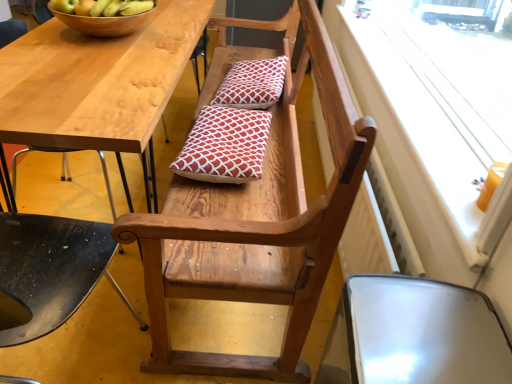
The width and height of the screenshot is (512, 384). I want to click on white matte window screen at upper right, so click(x=447, y=113).

Consider the image. What is the approximate width of wooden chair at lower center, which appears as the 3th chair when viewed from the right?

wooden chair at lower center, which appears as the 3th chair when viewed from the right, is 19.70 inches wide.

The image size is (512, 384). In order to click on red printed cushion at center, the 2th pillow positioned from the bottom in this screenshot , I will do `click(252, 84)`.

Describe the element at coordinates (104, 23) in the screenshot. I see `wooden bowl at upper left` at that location.

The height and width of the screenshot is (384, 512). What do you see at coordinates (424, 332) in the screenshot?
I see `metallic silver chair at lower right, the first chair in the right-to-left sequence` at bounding box center [424, 332].

Locate an element on the screen. This screenshot has height=384, width=512. wooden chair at center, the 2th chair positioned from the right is located at coordinates (256, 229).

This screenshot has width=512, height=384. Find the location of `white matte window screen at upper right`. white matte window screen at upper right is located at coordinates (447, 113).

Is green matte apple at upper left, positioned as the second apple in left-to-right order, facing away from red printed cushion at center, which ranks as the first pillow in bottom-to-top order?

green matte apple at upper left, positioned as the second apple in left-to-right order, does not have its back to red printed cushion at center, which ranks as the first pillow in bottom-to-top order.

From the image's perspective, which is above, green matte apple at upper left, which ranks as the 1th apple in right-to-left order, or red printed cushion at center, which ranks as the first pillow in bottom-to-top order?

green matte apple at upper left, which ranks as the 1th apple in right-to-left order, is shown above in the image.

Can you confirm if green matte apple at upper left, which ranks as the 1th apple in right-to-left order, is bigger than red printed cushion at center, the first pillow from the front?

No, green matte apple at upper left, which ranks as the 1th apple in right-to-left order, is not bigger than red printed cushion at center, the first pillow from the front.

Which of these two, green matte apple at upper left, which ranks as the 1th apple in right-to-left order, or red printed cushion at center, marked as the 2th pillow in a back-to-front arrangement, is wider?

Wider between the two is red printed cushion at center, marked as the 2th pillow in a back-to-front arrangement.

Considering the sizes of objects white matte window screen at upper right and metallic silver chair at lower right, the first chair in the right-to-left sequence, in the image provided, who is smaller, white matte window screen at upper right or metallic silver chair at lower right, the first chair in the right-to-left sequence,?

With smaller size is white matte window screen at upper right.

From the image's perspective, is white matte window screen at upper right located above or below metallic silver chair at lower right, which is counted as the 3th chair, starting from the left?

From the image's perspective, white matte window screen at upper right appears above metallic silver chair at lower right, which is counted as the 3th chair, starting from the left.

Which point is more distant from viewer, (456, 165) or (410, 375)?

The point (456, 165) is farther.

Would you consider white matte window screen at upper right to be distant from metallic silver chair at lower right, the first chair in the right-to-left sequence?

No, there isn't a large distance between white matte window screen at upper right and metallic silver chair at lower right, the first chair in the right-to-left sequence.

At what (x,y) coordinates should I click in order to perform the action: click on bowl that appears above the red printed cushion at center, the 1th pillow viewed from the top (from a real-world perspective). Please return your answer as a coordinate pair (x, y). Looking at the image, I should click on (104, 23).

Can you confirm if red printed cushion at center, the 2th pillow positioned from the bottom, is thinner than wooden bowl at upper left?

Indeed, red printed cushion at center, the 2th pillow positioned from the bottom, has a lesser width compared to wooden bowl at upper left.

From the image's perspective, would you say red printed cushion at center, the 1th pillow viewed from the top, is positioned over wooden bowl at upper left?

No, from the image's perspective, red printed cushion at center, the 1th pillow viewed from the top, is not over wooden bowl at upper left.

Would you consider red printed cushion at center, the 1th pillow viewed from the top, to be distant from wooden bowl at upper left?

No, red printed cushion at center, the 1th pillow viewed from the top, is in close proximity to wooden bowl at upper left.

Based on the photo, could you tell me if green matte apple at upper left, which ranks as the second apple in right-to-left order, is turned towards red printed cushion at center, the 1th pillow viewed from the top?

No.

In terms of width, does green matte apple at upper left, which ranks as the second apple in right-to-left order, look wider or thinner when compared to red printed cushion at center, the 2th pillow when ordered from front to back?

In the image, green matte apple at upper left, which ranks as the second apple in right-to-left order, appears to be more narrow than red printed cushion at center, the 2th pillow when ordered from front to back.

From the image's perspective, is green matte apple at upper left, which ranks as the second apple in right-to-left order, over red printed cushion at center, the 2th pillow positioned from the bottom?

Correct, green matte apple at upper left, which ranks as the second apple in right-to-left order, appears higher than red printed cushion at center, the 2th pillow positioned from the bottom, in the image.

Considering the relative positions of wooden chair at lower center, which appears as the 3th chair when viewed from the right, and green matte apple at upper left, positioned as the second apple in left-to-right order, in the image provided, is wooden chair at lower center, which appears as the 3th chair when viewed from the right, to the left of green matte apple at upper left, positioned as the second apple in left-to-right order, from the viewer's perspective?

Indeed, wooden chair at lower center, which appears as the 3th chair when viewed from the right, is positioned on the left side of green matte apple at upper left, positioned as the second apple in left-to-right order.

Does wooden chair at lower center, the first chair from the left, contain green matte apple at upper left, which ranks as the 1th apple in right-to-left order?

No, wooden chair at lower center, the first chair from the left, does not contain green matte apple at upper left, which ranks as the 1th apple in right-to-left order.

From the picture: What's the angular difference between wooden chair at lower center, the first chair from the left, and green matte apple at upper left, positioned as the second apple in left-to-right order,'s facing directions?

There is a 3.6-degree angle between the facing directions of wooden chair at lower center, the first chair from the left, and green matte apple at upper left, positioned as the second apple in left-to-right order.

Is wooden chair at lower center, the first chair from the left, facing away from green matte apple at upper left, positioned as the second apple in left-to-right order?

No, wooden chair at lower center, the first chair from the left, is not facing the opposite direction of green matte apple at upper left, positioned as the second apple in left-to-right order.

Is wooden chair at center, which is counted as the second chair, starting from the left, situated inside green matte apple at upper left, positioned as the second apple in left-to-right order, or outside?

The correct answer is: outside.

Can you confirm if wooden chair at center, which is counted as the second chair, starting from the left, is positioned to the right of green matte apple at upper left, positioned as the second apple in left-to-right order?

Indeed, wooden chair at center, which is counted as the second chair, starting from the left, is positioned on the right side of green matte apple at upper left, positioned as the second apple in left-to-right order.

Consider the image. Which object is further away from the camera taking this photo, wooden chair at center, the 2th chair positioned from the right, or green matte apple at upper left, positioned as the second apple in left-to-right order?

green matte apple at upper left, positioned as the second apple in left-to-right order, is behind.

Looking at this image, from the image's perspective, would you say wooden chair at center, which is counted as the second chair, starting from the left, is shown under green matte apple at upper left, which ranks as the 1th apple in right-to-left order?

Yes, from the image's perspective, wooden chair at center, which is counted as the second chair, starting from the left, is below green matte apple at upper left, which ranks as the 1th apple in right-to-left order.

Looking at this image, is metallic silver chair at lower right, the first chair in the right-to-left sequence, taller or shorter than green matte apple at upper left, the 1th apple in the left-to-right sequence?

metallic silver chair at lower right, the first chair in the right-to-left sequence, is taller than green matte apple at upper left, the 1th apple in the left-to-right sequence.

From the image's perspective, would you say metallic silver chair at lower right, which is counted as the 3th chair, starting from the left, is positioned over green matte apple at upper left, the 1th apple in the left-to-right sequence?

No, from the image's perspective, metallic silver chair at lower right, which is counted as the 3th chair, starting from the left, is not above green matte apple at upper left, the 1th apple in the left-to-right sequence.

Considering the sizes of objects metallic silver chair at lower right, which is counted as the 3th chair, starting from the left, and green matte apple at upper left, which ranks as the second apple in right-to-left order, in the image provided, who is bigger, metallic silver chair at lower right, which is counted as the 3th chair, starting from the left, or green matte apple at upper left, which ranks as the second apple in right-to-left order,?

metallic silver chair at lower right, which is counted as the 3th chair, starting from the left.

How many degrees apart are the facing directions of metallic silver chair at lower right, the first chair in the right-to-left sequence, and green matte apple at upper left, which ranks as the second apple in right-to-left order?

The angular difference between metallic silver chair at lower right, the first chair in the right-to-left sequence, and green matte apple at upper left, which ranks as the second apple in right-to-left order, is 90 degrees.

Locate an element on the screen. pillow that is the 2nd object directly below the green matte apple at upper left, positioned as the second apple in left-to-right order (from a real-world perspective) is located at coordinates (225, 146).

Find the location of a particular element. The width and height of the screenshot is (512, 384). chair that is the 2nd one when counting forward from the white matte window screen at upper right is located at coordinates (424, 332).

Looking at the image, which one is located closer to wooden chair at lower center, the first chair from the left, red printed cushion at center, the 2th pillow when ordered from front to back, or green matte apple at upper left, which ranks as the second apple in right-to-left order?

Based on the image, green matte apple at upper left, which ranks as the second apple in right-to-left order, appears to be nearer to wooden chair at lower center, the first chair from the left.

Estimate the real-world distances between objects in this image. Which object is further from green matte apple at upper left, the 1th apple in the left-to-right sequence, wooden chair at center, the 2th chair positioned from the right, or white matte window screen at upper right?

The object further to green matte apple at upper left, the 1th apple in the left-to-right sequence, is white matte window screen at upper right.

Considering their positions, is red printed cushion at center, which ranks as the first pillow in bottom-to-top order, positioned closer to wooden chair at lower center, which appears as the 3th chair when viewed from the right, than wooden chair at center, the 2th chair positioned from the right?

wooden chair at center, the 2th chair positioned from the right, is closer to wooden chair at lower center, which appears as the 3th chair when viewed from the right.

Considering their positions, is wooden chair at center, the 2th chair positioned from the right, positioned further to red printed cushion at center, the 2th pillow positioned from the bottom, than metallic silver chair at lower right, the first chair in the right-to-left sequence?

metallic silver chair at lower right, the first chair in the right-to-left sequence.

Consider the image. Based on their spatial positions, is green matte apple at upper left, which ranks as the second apple in right-to-left order, or wooden chair at center, the 2th chair positioned from the right, further from green matte apple at upper left, which ranks as the 1th apple in right-to-left order?

wooden chair at center, the 2th chair positioned from the right, is positioned further to the anchor green matte apple at upper left, which ranks as the 1th apple in right-to-left order.

From the image, which object appears to be nearer to wooden bowl at upper left, red printed cushion at center, which is the first pillow from back to front, or white matte window screen at upper right?

The object closer to wooden bowl at upper left is red printed cushion at center, which is the first pillow from back to front.

When comparing their distances from green matte apple at upper left, positioned as the second apple in left-to-right order, does wooden bowl at upper left or wooden chair at center, the 2th chair positioned from the right, seem further?

wooden chair at center, the 2th chair positioned from the right, lies further to green matte apple at upper left, positioned as the second apple in left-to-right order, than the other object.

Based on their spatial positions, is wooden chair at lower center, which appears as the 3th chair when viewed from the right, or green matte apple at upper left, positioned as the second apple in left-to-right order, further from wooden chair at center, which is counted as the second chair, starting from the left?

Among the two, green matte apple at upper left, positioned as the second apple in left-to-right order, is located further to wooden chair at center, which is counted as the second chair, starting from the left.

Where is `window screen between wooden chair at center, the 2th chair positioned from the right, and red printed cushion at center, the 1th pillow viewed from the top, from front to back`? Image resolution: width=512 pixels, height=384 pixels. window screen between wooden chair at center, the 2th chair positioned from the right, and red printed cushion at center, the 1th pillow viewed from the top, from front to back is located at coordinates (447, 113).

This screenshot has width=512, height=384. Find the location of `bowl situated between green matte apple at upper left, the 1th apple in the left-to-right sequence, and white matte window screen at upper right from left to right`. bowl situated between green matte apple at upper left, the 1th apple in the left-to-right sequence, and white matte window screen at upper right from left to right is located at coordinates (104, 23).

The height and width of the screenshot is (384, 512). Find the location of `bowl between green matte apple at upper left, the 1th apple in the left-to-right sequence, and wooden chair at lower center, which appears as the 3th chair when viewed from the right, from top to bottom`. bowl between green matte apple at upper left, the 1th apple in the left-to-right sequence, and wooden chair at lower center, which appears as the 3th chair when viewed from the right, from top to bottom is located at coordinates point(104,23).

Find the location of `pillow between wooden chair at center, the 2th chair positioned from the right, and red printed cushion at center, the 2th pillow positioned from the bottom, along the z-axis`. pillow between wooden chair at center, the 2th chair positioned from the right, and red printed cushion at center, the 2th pillow positioned from the bottom, along the z-axis is located at coordinates (225, 146).